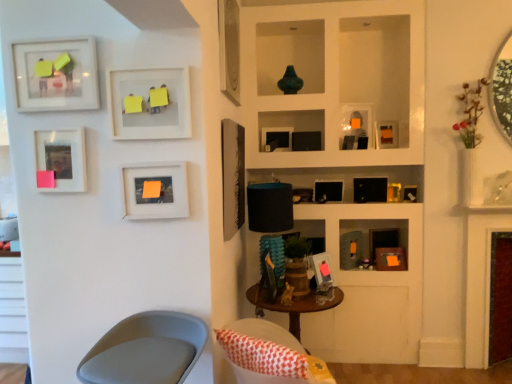
This screenshot has width=512, height=384. Describe the element at coordinates (146, 350) in the screenshot. I see `matte gray chair at lower left, arranged as the 2th chair when viewed from the right` at that location.

Image resolution: width=512 pixels, height=384 pixels. I want to click on black matte picture frame at center, the 6th picture frame when ordered from right to left, so click(328, 191).

Describe the element at coordinates (370, 190) in the screenshot. I see `black matte picture frame at upper right, placed as the fourth picture frame when sorted from right to left` at that location.

Image resolution: width=512 pixels, height=384 pixels. In order to click on matte gray chair at lower left, arranged as the 1th chair when viewed from the left in this screenshot , I will do `click(146, 350)`.

Is white matte picture frame at upper left, acting as the eleventh picture frame starting from the right, positioned far away from matte black picture frame at upper right, which ranks as the second picture frame in right-to-left order?

That's right, there is a large distance between white matte picture frame at upper left, acting as the eleventh picture frame starting from the right, and matte black picture frame at upper right, which ranks as the second picture frame in right-to-left order.

Between white matte picture frame at upper left, the 3th picture frame in the left-to-right sequence, and matte black picture frame at upper right, arranged as the 12th picture frame when viewed from the left, which one has larger width?

With larger width is matte black picture frame at upper right, arranged as the 12th picture frame when viewed from the left.

Is white matte picture frame at upper left, the 3th picture frame in the left-to-right sequence, smaller than matte black picture frame at upper right, arranged as the 12th picture frame when viewed from the left?

No.

In the scene shown: Could you measure the distance between white matte picture frame at upper left, acting as the eleventh picture frame starting from the right, and matte black picture frame at upper right, arranged as the 12th picture frame when viewed from the left?

white matte picture frame at upper left, acting as the eleventh picture frame starting from the right, and matte black picture frame at upper right, arranged as the 12th picture frame when viewed from the left, are 2.06 meters apart.

From the image's perspective, is black matte picture frame at center, the 8th picture frame when ordered from left to right, located above or below white matte picture frame at upper left, acting as the eleventh picture frame starting from the right?

black matte picture frame at center, the 8th picture frame when ordered from left to right, is situated lower than white matte picture frame at upper left, acting as the eleventh picture frame starting from the right, in the image.

Is black matte picture frame at center, the 8th picture frame when ordered from left to right, located outside white matte picture frame at upper left, acting as the eleventh picture frame starting from the right?

black matte picture frame at center, the 8th picture frame when ordered from left to right, is positioned outside white matte picture frame at upper left, acting as the eleventh picture frame starting from the right.

Can you tell me how much black matte picture frame at center, the 8th picture frame when ordered from left to right, and white matte picture frame at upper left, acting as the eleventh picture frame starting from the right, differ in facing direction?

7.87 degrees separate the facing orientations of black matte picture frame at center, the 8th picture frame when ordered from left to right, and white matte picture frame at upper left, acting as the eleventh picture frame starting from the right.

Between black matte picture frame at center, the 8th picture frame when ordered from left to right, and white matte picture frame at upper left, the 3th picture frame in the left-to-right sequence, which one is positioned behind?

black matte picture frame at center, the 8th picture frame when ordered from left to right, is more distant.

From a real-world perspective, is matte white picture frame at left, placed as the 12th picture frame when sorted from right to left, positioned over matte black picture frame at center, which is the eighth picture frame from right to left, based on gravity?

Indeed, from a real-world perspective, matte white picture frame at left, placed as the 12th picture frame when sorted from right to left, stands above matte black picture frame at center, which is the eighth picture frame from right to left.

Which object is wider, matte white picture frame at left, which is counted as the second picture frame, starting from the left, or matte black picture frame at center, which is the eighth picture frame from right to left?

matte black picture frame at center, which is the eighth picture frame from right to left.

Visually, is matte white picture frame at left, placed as the 12th picture frame when sorted from right to left, positioned to the left or to the right of matte black picture frame at center, which is the eighth picture frame from right to left?

In the image, matte white picture frame at left, placed as the 12th picture frame when sorted from right to left, appears on the left side of matte black picture frame at center, which is the eighth picture frame from right to left.

Is point (79, 188) closer to viewer compared to point (225, 236)?

Yes.

Which of these two, black matte picture frame at center, the 6th picture frame when ordered from right to left, or wooden table at center, is thinner?

With smaller width is black matte picture frame at center, the 6th picture frame when ordered from right to left.

Could you tell me if black matte picture frame at center, the 6th picture frame when ordered from right to left, is turned towards wooden table at center?

No, black matte picture frame at center, the 6th picture frame when ordered from right to left, does not turn towards wooden table at center.

From a real-world perspective, which object stands above the other?

In real-world perspective, black matte picture frame at center, the 6th picture frame when ordered from right to left, is above.

What's the angular difference between black matte picture frame at center, the 8th picture frame when ordered from left to right, and wooden table at center's facing directions?

black matte picture frame at center, the 8th picture frame when ordered from left to right, and wooden table at center are facing 96.8 degrees away from each other.

Identify the location of the 2nd chair in front of the black matte picture frame at center, the 8th picture frame when ordered from left to right, starting your count from the anchor. (146, 350).

Which of these two, black matte picture frame at center, the 6th picture frame when ordered from right to left, or matte gray chair at lower left, arranged as the 2th chair when viewed from the right, is wider?

Wider between the two is matte gray chair at lower left, arranged as the 2th chair when viewed from the right.

From the image's perspective, which is above, black matte picture frame at center, the 6th picture frame when ordered from right to left, or matte gray chair at lower left, arranged as the 1th chair when viewed from the left?

From the image's view, black matte picture frame at center, the 6th picture frame when ordered from right to left, is above.

Is matte gray chair at lower left, arranged as the 1th chair when viewed from the left, surrounded by black matte picture frame at center, the 6th picture frame when ordered from right to left?

Actually, matte gray chair at lower left, arranged as the 1th chair when viewed from the left, is outside black matte picture frame at center, the 6th picture frame when ordered from right to left.

Which is correct: matte black picture frame at center, positioned as the seventh picture frame in right-to-left order, is inside metallic silver mirror at upper right, or outside of it?

matte black picture frame at center, positioned as the seventh picture frame in right-to-left order, is spatially situated outside metallic silver mirror at upper right.

From the image's perspective, does matte black picture frame at center, positioned as the seventh picture frame in right-to-left order, appear lower than metallic silver mirror at upper right?

Yes.

How different are the orientations of matte black picture frame at center, positioned as the 7th picture frame in left-to-right order, and metallic silver mirror at upper right in degrees?

48 degrees separate the facing orientations of matte black picture frame at center, positioned as the 7th picture frame in left-to-right order, and metallic silver mirror at upper right.

Which is in front, point (231, 56) or point (473, 292)?

The point (473, 292) is more forward.

Does matte wooden picture frame at upper center, positioned as the ninth picture frame in right-to-left order, have a smaller size compared to maroon velvet fireplace at right?

Yes.

Consider the image. From a real-world perspective, is matte wooden picture frame at upper center, positioned as the ninth picture frame in right-to-left order, below maroon velvet fireplace at right?

No.

How different are the orientations of matte wooden picture frame at upper center, positioned as the ninth picture frame in right-to-left order, and maroon velvet fireplace at right in degrees?

87.6 degrees.

What are the coordinates of `the 2nd picture frame directly beneath the white matte picture frame at upper left, acting as the eleventh picture frame starting from the right (from a real-world perspective)` in the screenshot? It's located at (386, 134).

Identify the location of the 5th picture frame to the left when counting from the black matte picture frame at center, the 8th picture frame when ordered from left to right. Image resolution: width=512 pixels, height=384 pixels. (149, 104).

From the image, which object appears to be nearer to matte black picture frame at center, positioned as the seventh picture frame in right-to-left order, matte black picture frame at upper right, which is the 1th picture frame from right to left, or black matte picture frame at center, the 8th picture frame when ordered from left to right?

black matte picture frame at center, the 8th picture frame when ordered from left to right.

Estimate the real-world distances between objects in this image. Which object is further from black matte picture frame at center, the 8th picture frame when ordered from left to right, white fabric chair at lower center, placed as the 2th chair when sorted from left to right, or matte black picture frame at upper right, arranged as the 12th picture frame when viewed from the left?

The object further to black matte picture frame at center, the 8th picture frame when ordered from left to right, is white fabric chair at lower center, placed as the 2th chair when sorted from left to right.

Based on their spatial positions, is matte black picture frame at center, which is the eighth picture frame from right to left, or black matte picture frame at center, the 6th picture frame when ordered from right to left, further from white fabric chair at lower center, the first chair when ordered from right to left?

black matte picture frame at center, the 6th picture frame when ordered from right to left.

Based on their spatial positions, is matte white picture frame at upper left, acting as the first picture frame starting from the left, or matte wood picture frame at center, the tenth picture frame in the right-to-left sequence, further from matte gray chair at lower left, arranged as the 2th chair when viewed from the right?

Among the two, matte white picture frame at upper left, acting as the first picture frame starting from the left, is located further to matte gray chair at lower left, arranged as the 2th chair when viewed from the right.

Based on their spatial positions, is matte black lampshade at center or matte white picture frame at upper left, acting as the first picture frame starting from the left, further from matte black picture frame at center, the sixth picture frame positioned from the left?

matte white picture frame at upper left, acting as the first picture frame starting from the left, is further to matte black picture frame at center, the sixth picture frame positioned from the left.

From the image, which object appears to be farther from matte wood picture frame at center, the fourth picture frame when ordered from left to right, black matte picture frame at center, the 8th picture frame when ordered from left to right, or white fabric chair at lower center, the first chair when ordered from right to left?

The object further to matte wood picture frame at center, the fourth picture frame when ordered from left to right, is black matte picture frame at center, the 8th picture frame when ordered from left to right.

Which object lies further to the anchor point matte black picture frame at center, the sixth picture frame positioned from the left, matte black picture frame at upper right, which ranks as the second picture frame in right-to-left order, or matte wooden picture frame at upper center, positioned as the fifth picture frame in left-to-right order?

matte black picture frame at upper right, which ranks as the second picture frame in right-to-left order.

In the scene shown: From the image, which object appears to be nearer to wooden table at center, matte black picture frame at upper right, which ranks as the second picture frame in right-to-left order, or matte wooden picture frame at upper center, positioned as the ninth picture frame in right-to-left order?

matte black picture frame at upper right, which ranks as the second picture frame in right-to-left order.

Find the location of `lamp between matte gray chair at lower left, arranged as the 2th chair when viewed from the right, and metallic silver mirror at upper right`. lamp between matte gray chair at lower left, arranged as the 2th chair when viewed from the right, and metallic silver mirror at upper right is located at coordinates (x=270, y=207).

The width and height of the screenshot is (512, 384). In order to click on fireplace that lies between metallic silver mirror at upper right and wooden table at center from top to bottom in this screenshot , I will do `click(480, 280)`.

Locate an element on the screen. table located between white fabric chair at lower center, the first chair when ordered from right to left, and black matte picture frame at center, the 8th picture frame when ordered from left to right, in the depth direction is located at coordinates (291, 306).

Identify the location of table located between matte wood picture frame at center, the fourth picture frame when ordered from left to right, and maroon velvet fireplace at right in the left-right direction. (291, 306).